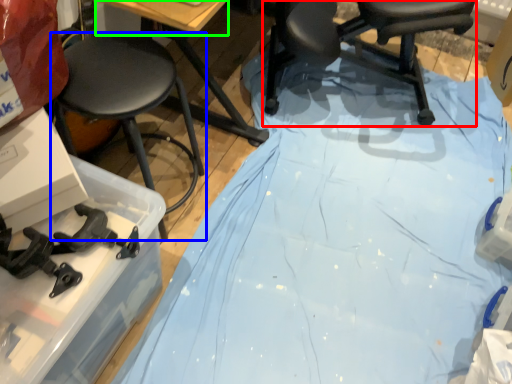
Question: Based on their relative distances, which object is farther from chair (highlighted by a red box)? Choose from stool (highlighted by a blue box) and table top (highlighted by a green box).

Choices:
 (A) stool
 (B) table top

Answer: (A)